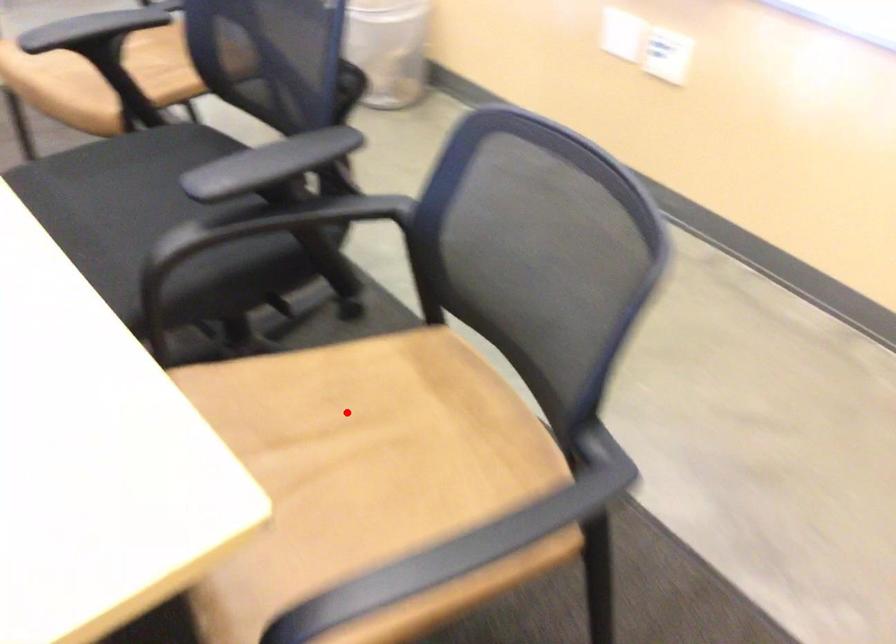
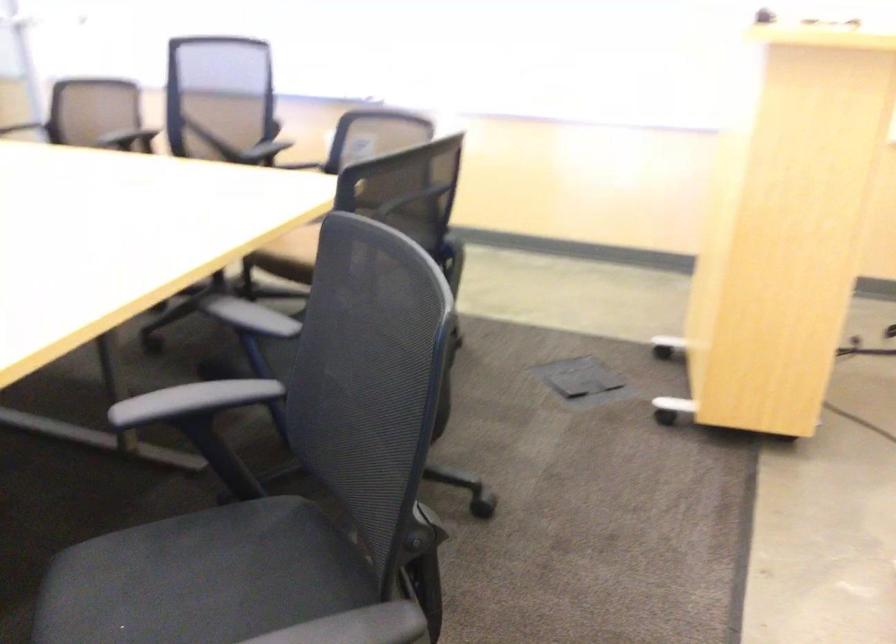
Question: I am providing you with two images of the same scene from different viewpoints. A red point is marked on the first image. Can you still see the location of the red point in image 2?

Choices:
 (A) Yes
 (B) No

Answer: (B)